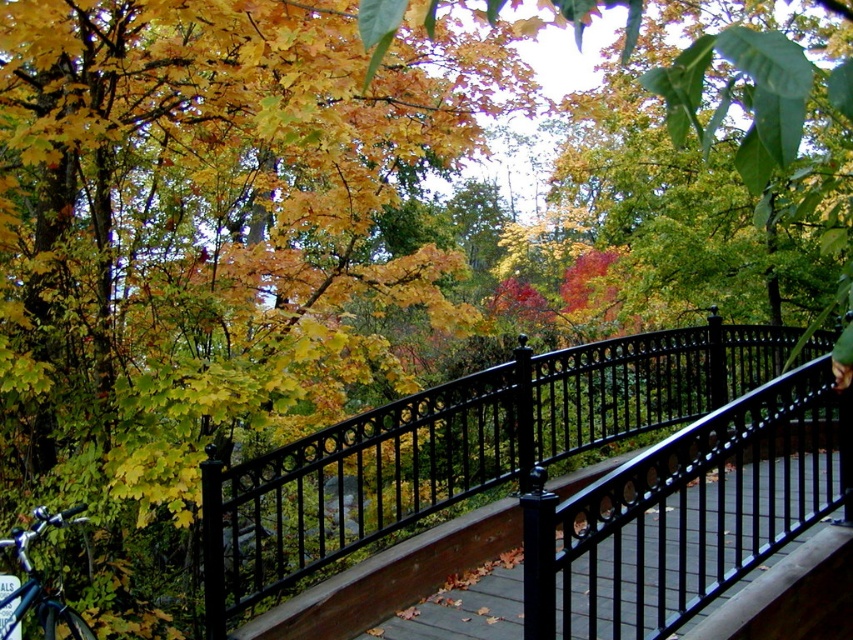
Which of these two, black wrought iron fence at center or shiny blue bicycle at lower left, stands taller?

black wrought iron fence at center is taller.

Describe the element at coordinates (463, 444) in the screenshot. I see `black wrought iron fence at center` at that location.

Find the location of `black wrought iron fence at center`. black wrought iron fence at center is located at coordinates (463, 444).